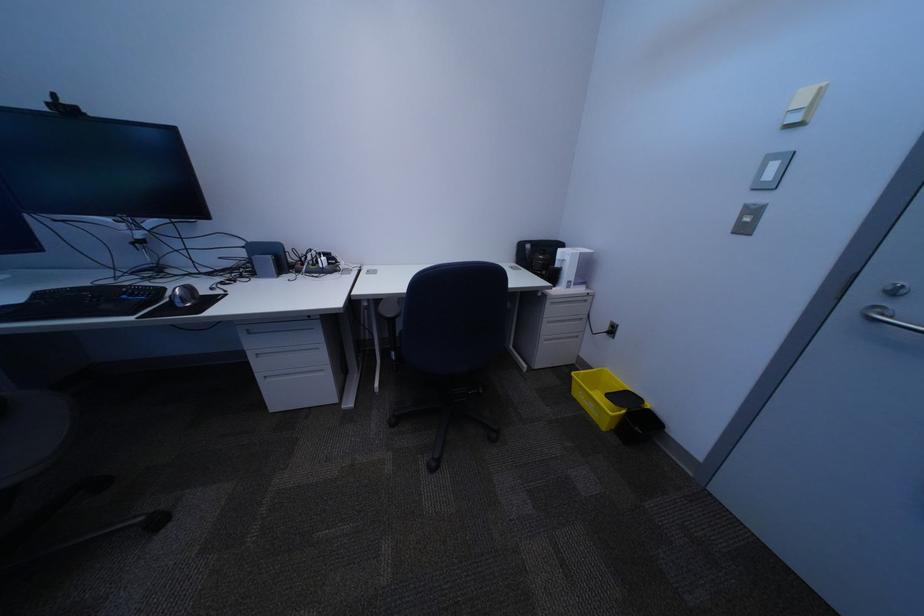
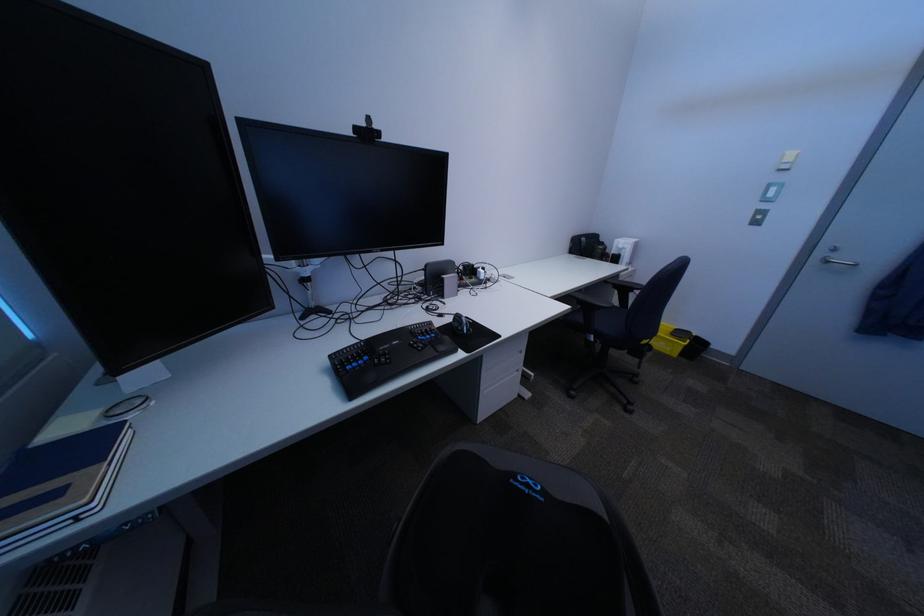
Question: The images are taken continuously from a first-person perspective. In which direction are you moving?

Choices:
 (A) Left
 (B) Right
 (C) Forward
 (D) Backward

Answer: (A)